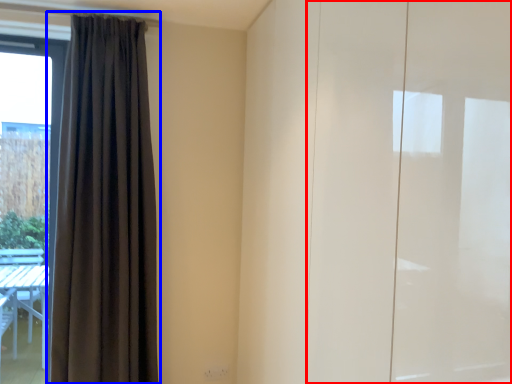
Question: Which of the following is the farthest to the observer, screen door (highlighted by a red box) or curtain (highlighted by a blue box)?

Choices:
 (A) screen door
 (B) curtain

Answer: (B)